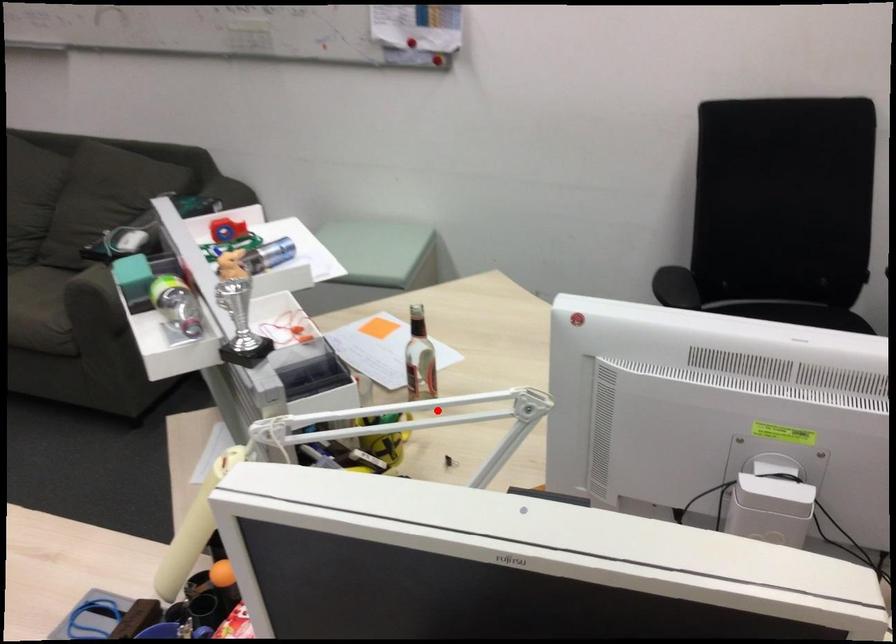
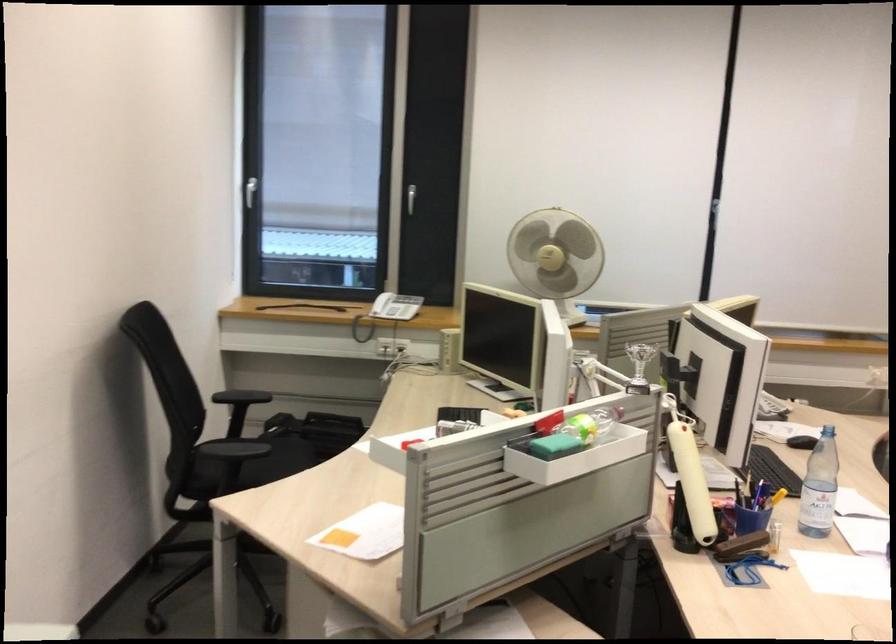
Question: I am providing you with two images of the same scene from different viewpoints. A red point is marked on the first image. Can you still see the location of the red point in image 2?

Choices:
 (A) Yes
 (B) No

Answer: (B)